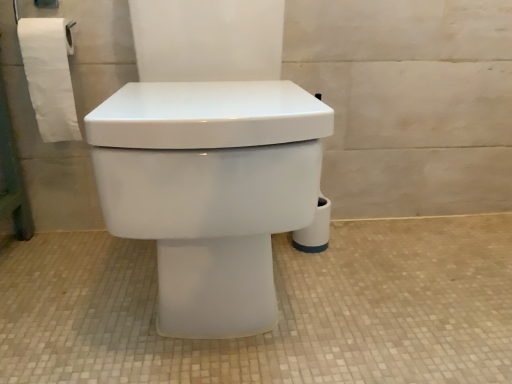
Question: From a real-world perspective, is white paper at left located higher than white glossy toilet at center?

Choices:
 (A) yes
 (B) no

Answer: (A)

Question: Is white paper at left positioned with its back to white glossy toilet at center?

Choices:
 (A) yes
 (B) no

Answer: (B)

Question: Is white paper at left thinner than white glossy toilet at center?

Choices:
 (A) yes
 (B) no

Answer: (A)

Question: Considering the relative positions of white paper at left and white glossy toilet at center in the image provided, is white paper at left to the left of white glossy toilet at center from the viewer's perspective?

Choices:
 (A) yes
 (B) no

Answer: (A)

Question: Is white glossy toilet at center completely or partially inside white paper at left?

Choices:
 (A) no
 (B) yes

Answer: (A)

Question: Does white paper at left have a greater height compared to white glossy toilet at center?

Choices:
 (A) yes
 (B) no

Answer: (B)

Question: Does white glossy toilet at center turn towards white paper at left?

Choices:
 (A) yes
 (B) no

Answer: (B)

Question: Is white glossy toilet at center at the left side of white paper at left?

Choices:
 (A) yes
 (B) no

Answer: (B)

Question: Does white glossy toilet at center have a lesser height compared to white paper at left?

Choices:
 (A) yes
 (B) no

Answer: (B)

Question: Can you confirm if white glossy toilet at center is thinner than white paper at left?

Choices:
 (A) no
 (B) yes

Answer: (A)

Question: From the image's perspective, does white glossy toilet at center appear higher than white paper at left?

Choices:
 (A) no
 (B) yes

Answer: (A)

Question: Is white glossy toilet at center to the right of white paper at left from the viewer's perspective?

Choices:
 (A) no
 (B) yes

Answer: (B)

Question: Relative to white glossy toilet at center, is white paper at left in front or behind?

Choices:
 (A) behind
 (B) front

Answer: (A)